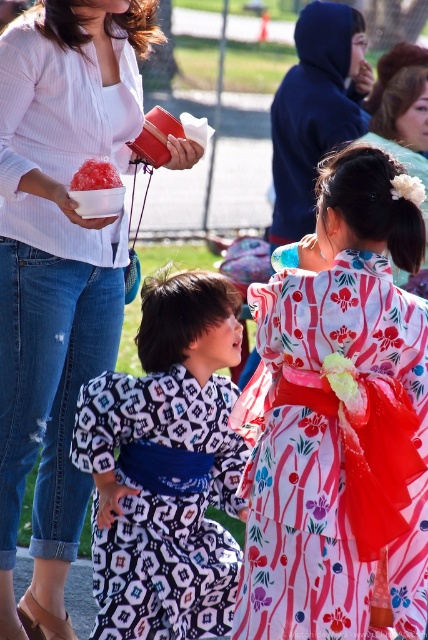
You are an observer at the event. You see the white ribbed sweater at upper left and the patterned silk kimono at center. Which one is positioned higher in the image?

The white ribbed sweater at upper left is positioned higher in the image because it is located above the patterned silk kimono at center.

You are an event photographer at the cultural event. You need to capture a closeup shot of the patterned silk kimono at center. The camera focus point is currently at point (166, 467). Is this point on the patterned silk kimono at center?

Yes, the point (166, 467) is on the patterned silk kimono at center, so the focus point is correctly placed.